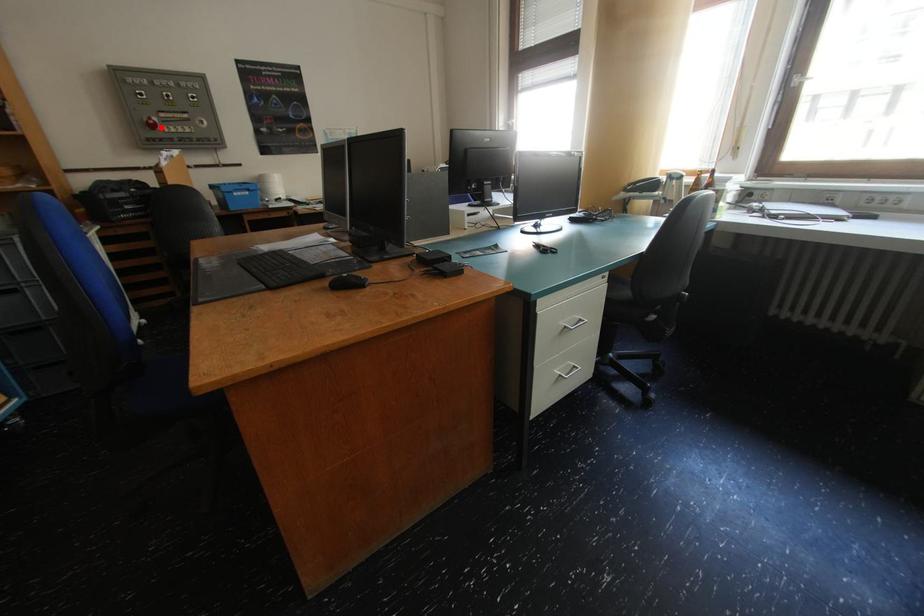
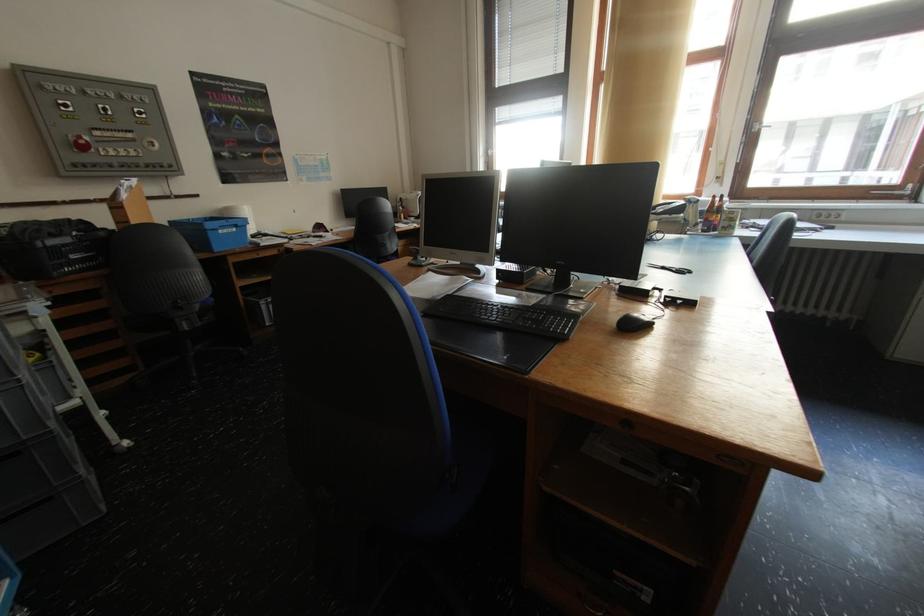
Find the pixel in the second image that matches the highlighted location in the first image.

(91, 148)